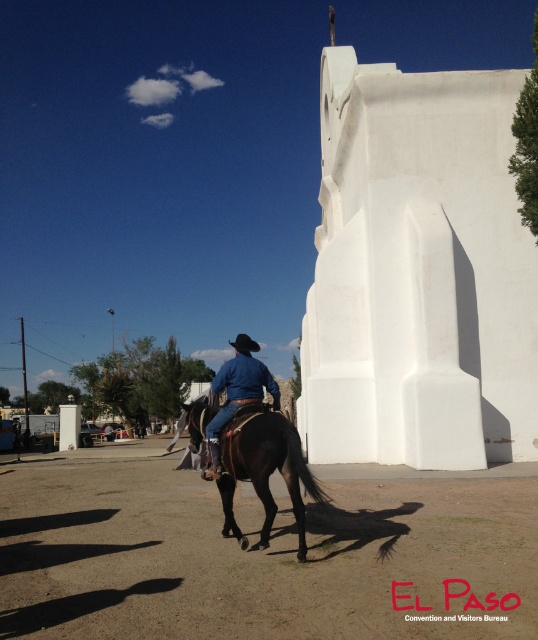
Question: Does brown glossy horse at center appear under blue denim jeans at center?

Choices:
 (A) no
 (B) yes

Answer: (B)

Question: Which object appears closest to the camera in this image?

Choices:
 (A) brown glossy horse at center
 (B) blue denim jeans at center

Answer: (A)

Question: Does brown glossy horse at center have a smaller size compared to blue denim jeans at center?

Choices:
 (A) no
 (B) yes

Answer: (B)

Question: Which point is farther from the camera taking this photo?

Choices:
 (A) (195, 440)
 (B) (245, 362)

Answer: (A)

Question: In this image, where is brown glossy horse at center located relative to blue denim jeans at center?

Choices:
 (A) right
 (B) left

Answer: (A)